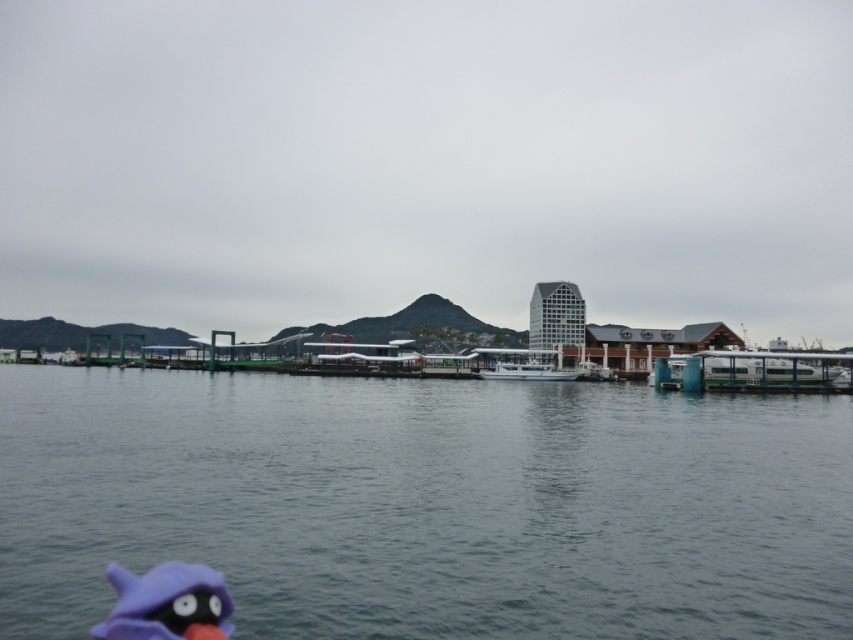
You are a photographer trying to capture a shot of the gray water at center and the white glossy boat at center from a distance. If your camera has a maximum focus range of 150 feet, will you be able to focus on both objects clearly?

The gray water at center is 149.98 feet from the white glossy boat at center. Since the distance between them is just under 150 feet, your camera can focus on both objects clearly within its maximum range.

You are a photographer trying to capture the white glossy boat at right and the white glossy boat at center. Since you want to emphasize the size difference between them, which boat should you frame closer to highlight its larger size?

The white glossy boat at right is wider than the white glossy boat at center, so to emphasize its larger size, you should frame the white glossy boat at right closer to the camera.

You are a photographer trying to capture both the white glossy boat at right and the white glossy boat at center in a single frame. Given that your camera can only focus on objects within a 10m range, which boat should you prioritize to ensure it is in focus?

The white glossy boat at right is larger in size than the white glossy boat at center, so you should prioritize focusing on the white glossy boat at right to ensure it is in focus within the camera range.